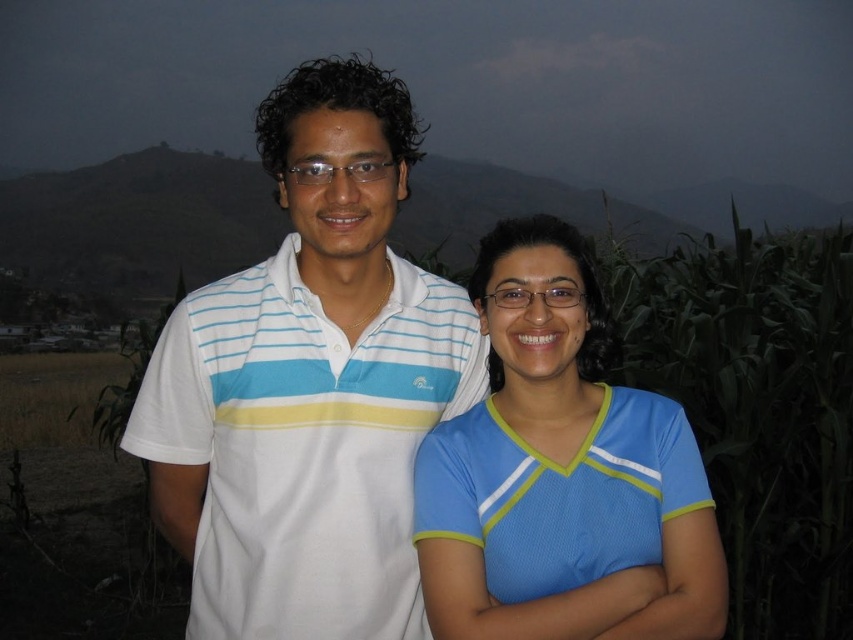
Question: Is white striped polo shirt at center to the left of blue mesh shirt at center from the viewer's perspective?

Choices:
 (A) no
 (B) yes

Answer: (B)

Question: Does white striped polo shirt at center have a lesser width compared to blue mesh shirt at center?

Choices:
 (A) yes
 (B) no

Answer: (B)

Question: Can you confirm if white striped polo shirt at center is wider than blue mesh shirt at center?

Choices:
 (A) no
 (B) yes

Answer: (B)

Question: Among these points, which one is farthest from the camera?

Choices:
 (A) (439, 580)
 (B) (370, 157)

Answer: (B)

Question: Which object is closer to the camera taking this photo?

Choices:
 (A) white striped polo shirt at center
 (B) blue mesh shirt at center

Answer: (B)